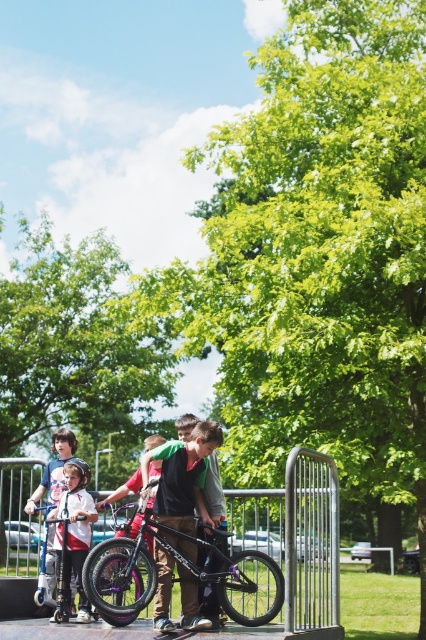
Question: Which of the following is the closest to the observer?

Choices:
 (A) shiny purple bicycle at center
 (B) matte black shirt at center
 (C) white matte scooter at lower left

Answer: (B)

Question: Which object is positioned closest to the shiny purple bicycle at center?

Choices:
 (A) white matte scooter at lower left
 (B) matte black shirt at center

Answer: (B)

Question: Considering the relative positions of matte black shirt at center and white matte scooter at lower left in the image provided, where is matte black shirt at center located with respect to white matte scooter at lower left?

Choices:
 (A) above
 (B) below

Answer: (A)

Question: Considering the relative positions of shiny purple bicycle at center and white matte scooter at lower left in the image provided, where is shiny purple bicycle at center located with respect to white matte scooter at lower left?

Choices:
 (A) above
 (B) below

Answer: (B)

Question: Can you confirm if shiny purple bicycle at center is bigger than white matte scooter at lower left?

Choices:
 (A) yes
 (B) no

Answer: (A)

Question: Which point is farther to the camera?

Choices:
 (A) (210, 518)
 (B) (135, 552)

Answer: (A)